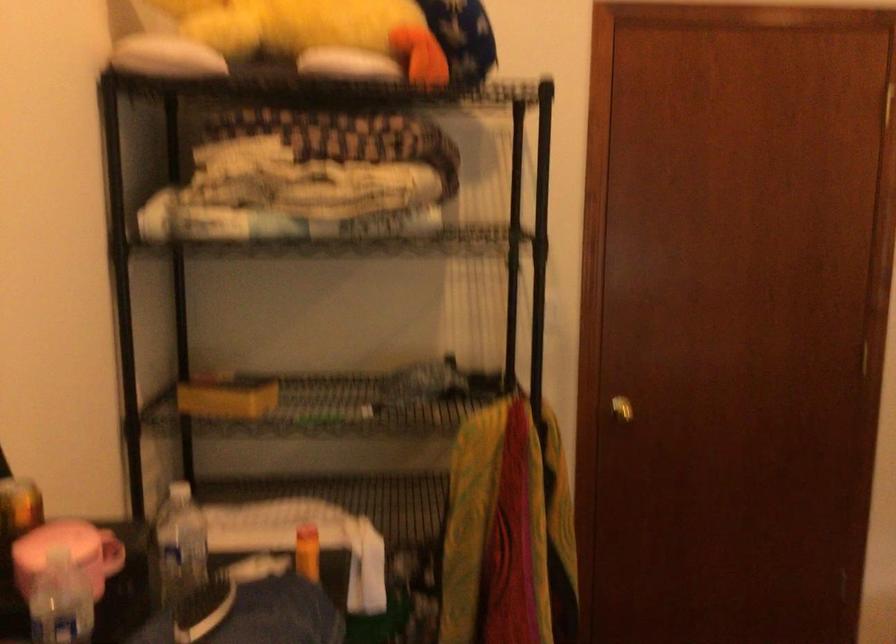
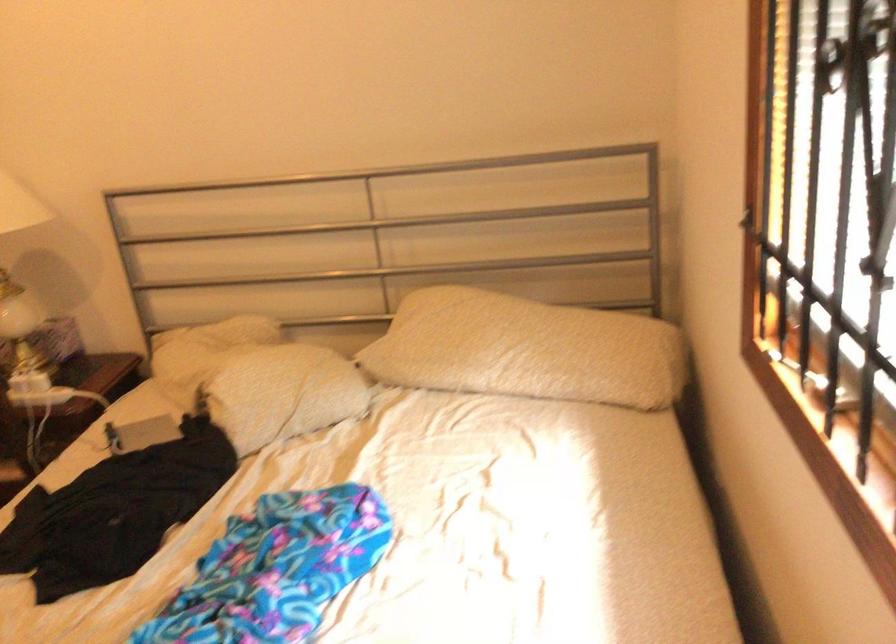
Looking at this image, the images are taken continuously from a first-person perspective. In which direction is your viewpoint rotating?

The rotation direction of the camera is right-down.